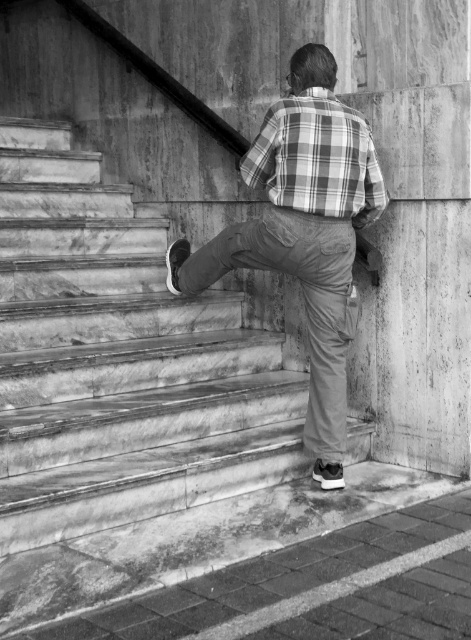
Which of these two, plaid cotton shirt at center or plaid fabric shirt at center, stands shorter?

Standing shorter between the two is plaid fabric shirt at center.

Is point (295, 129) less distant than point (276, 189)?

Yes, it is.

Find the location of a particular element. plaid cotton shirt at center is located at coordinates (303, 230).